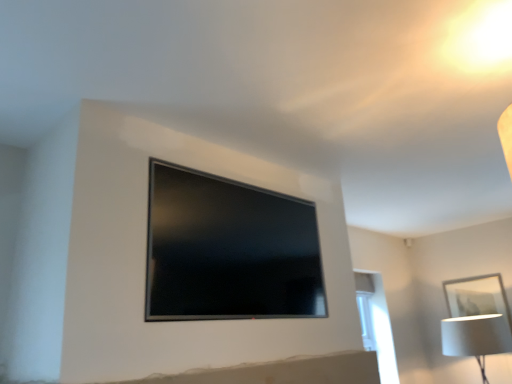
Question: Is white fabric lampshade at lower right next to white matte picture frame at lower right and touching it?

Choices:
 (A) yes
 (B) no

Answer: (B)

Question: Considering the relative sizes of white fabric lampshade at lower right and white matte picture frame at lower right in the image provided, is white fabric lampshade at lower right wider than white matte picture frame at lower right?

Choices:
 (A) yes
 (B) no

Answer: (A)

Question: From the image's perspective, would you say white fabric lampshade at lower right is shown under white matte picture frame at lower right?

Choices:
 (A) no
 (B) yes

Answer: (B)

Question: Can you confirm if white fabric lampshade at lower right is shorter than white matte picture frame at lower right?

Choices:
 (A) no
 (B) yes

Answer: (B)

Question: Can you confirm if white fabric lampshade at lower right is smaller than white matte picture frame at lower right?

Choices:
 (A) yes
 (B) no

Answer: (B)

Question: From the image's perspective, is white fabric lampshade at lower right on top of white matte picture frame at lower right?

Choices:
 (A) yes
 (B) no

Answer: (B)

Question: Is white glossy window at right bigger than matte black tv at center?

Choices:
 (A) no
 (B) yes

Answer: (B)

Question: Is white glossy window at right to the right of matte black tv at center from the viewer's perspective?

Choices:
 (A) no
 (B) yes

Answer: (B)

Question: From the image's perspective, would you say white glossy window at right is positioned over matte black tv at center?

Choices:
 (A) yes
 (B) no

Answer: (B)

Question: Considering the relative sizes of white glossy window at right and matte black tv at center in the image provided, is white glossy window at right shorter than matte black tv at center?

Choices:
 (A) yes
 (B) no

Answer: (B)

Question: Are white glossy window at right and matte black tv at center making contact?

Choices:
 (A) no
 (B) yes

Answer: (A)

Question: Does white glossy window at right have a greater width compared to matte black tv at center?

Choices:
 (A) no
 (B) yes

Answer: (B)

Question: Is white matte picture frame at lower right at the right side of white glossy window at right?

Choices:
 (A) no
 (B) yes

Answer: (B)